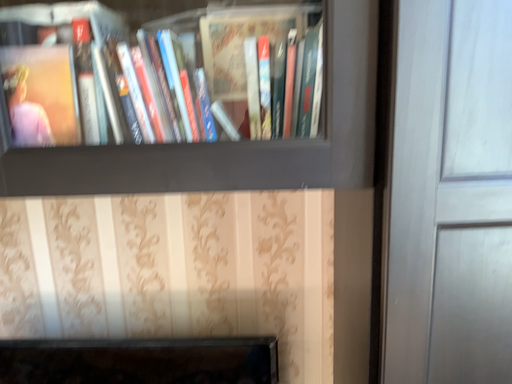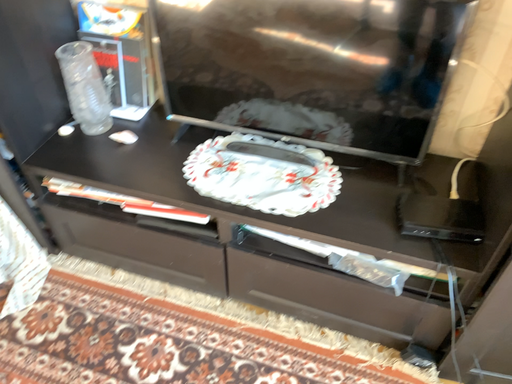
Question: How did the camera likely rotate when shooting the video?

Choices:
 (A) rotated upward
 (B) rotated downward

Answer: (B)